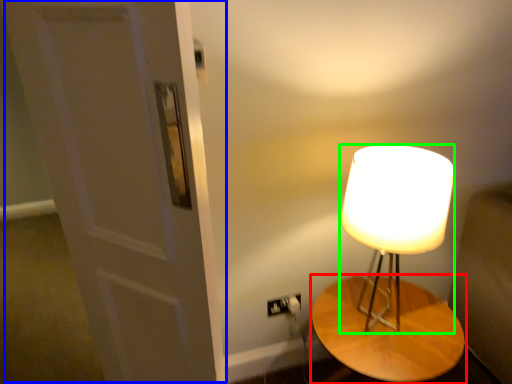
Question: Which is farther away from table (highlighted by a red box)? door (highlighted by a blue box) or lamp (highlighted by a green box)?

Choices:
 (A) door
 (B) lamp

Answer: (A)